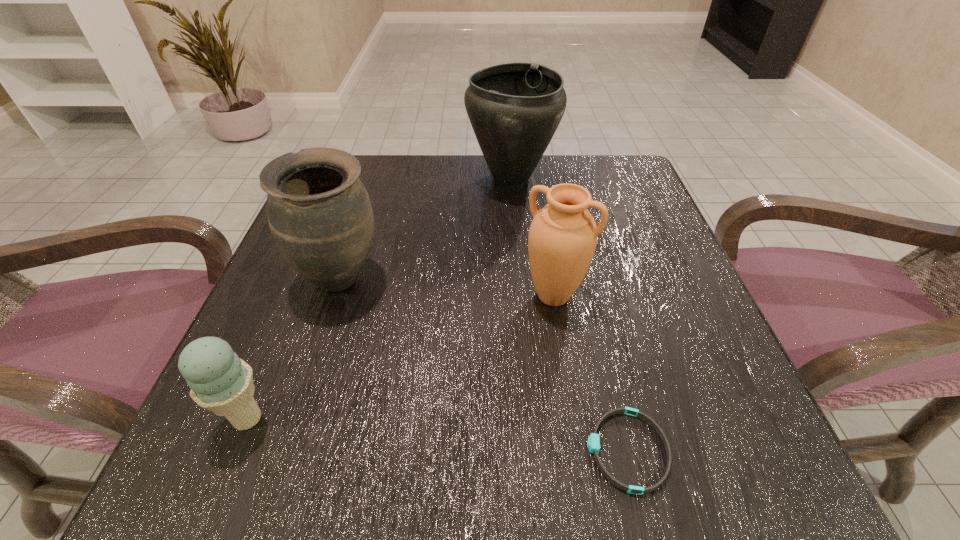
What are the coordinates of `object situated at the far edge` in the screenshot? It's located at pyautogui.click(x=515, y=108).

Image resolution: width=960 pixels, height=540 pixels. I want to click on ice cream that is at the near edge, so click(221, 382).

Locate an element on the screen. wristband that is positioned at the near edge is located at coordinates (593, 443).

At what (x,y) coordinates should I click in order to perform the action: click on urn that is at the left edge. Please return your answer as a coordinate pair (x, y). Looking at the image, I should click on (319, 212).

Find the location of a particular element. Image resolution: width=960 pixels, height=540 pixels. ice cream present at the left edge is located at coordinates (221, 382).

Where is `object situated at the right edge`? object situated at the right edge is located at coordinates (593, 443).

At what (x,y) coordinates should I click in order to perform the action: click on object located at the near left corner. Please return your answer as a coordinate pair (x, y). Looking at the image, I should click on (221, 382).

Where is `object positioned at the near right corner`? Image resolution: width=960 pixels, height=540 pixels. object positioned at the near right corner is located at coordinates (593, 443).

In the image, there is a desktop. Identify the location of free region at the far edge. (560, 173).

Where is `vacant space at the near edge`? The height and width of the screenshot is (540, 960). vacant space at the near edge is located at coordinates point(387,449).